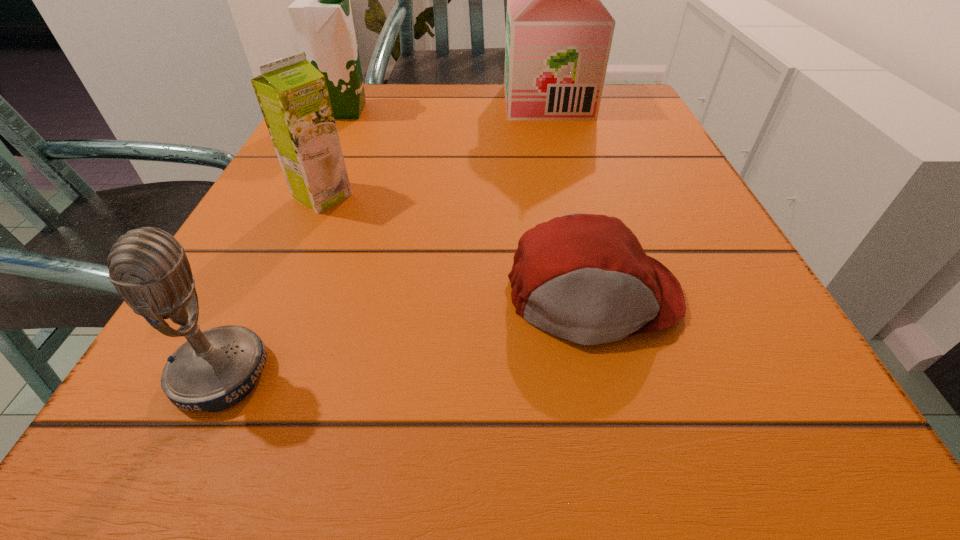
I want to click on vacant area located 0.070m on the front-facing side of the shortest object, so click(621, 408).

Locate an element on the screen. Image resolution: width=960 pixels, height=540 pixels. object that is positioned at the near edge is located at coordinates pyautogui.click(x=213, y=370).

You are a GUI agent. You are given a task and a screenshot of the screen. Output one action in this format:
    pyautogui.click(x=<x>, y=<y>)
    Task: Click on the microphone present at the left edge
    This screenshot has width=960, height=540.
    Given the screenshot: What is the action you would take?
    pyautogui.click(x=213, y=370)

Where is `soya milk located at the right edge`? soya milk located at the right edge is located at coordinates (558, 32).

I want to click on cap situated at the right edge, so click(x=585, y=278).

The height and width of the screenshot is (540, 960). I want to click on object positioned at the far left corner, so point(321,14).

This screenshot has width=960, height=540. Identify the location of object that is positioned at the near left corner. (213, 370).

In order to click on object at the far right corner in this screenshot , I will do `click(558, 32)`.

Image resolution: width=960 pixels, height=540 pixels. I want to click on vacant region at the far edge, so click(474, 126).

In the image, there is a desktop. At what (x,y) coordinates should I click in order to perform the action: click on free region at the near edge. Please return your answer as a coordinate pair (x, y). This screenshot has width=960, height=540. Looking at the image, I should click on (449, 418).